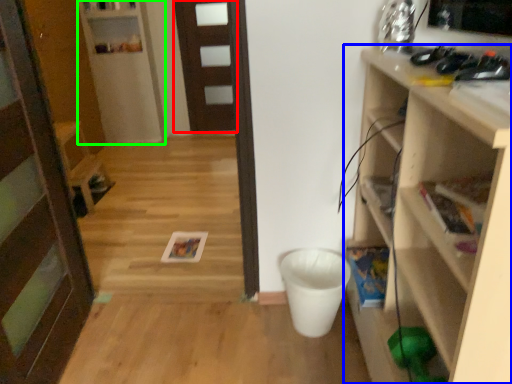
Question: Based on their relative distances, which object is farther from door (highlighted by a red box)? Choose from shelf (highlighted by a blue box) and shelf (highlighted by a green box).

Choices:
 (A) shelf
 (B) shelf

Answer: (A)